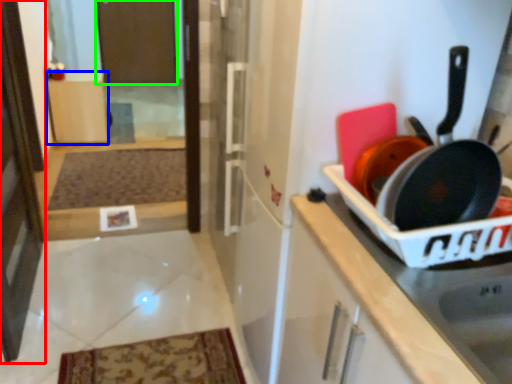
Question: Considering the real-world distances, which object is farthest from screen door (highlighted by a red box)? cabinetry (highlighted by a blue box) or screen door (highlighted by a green box)?

Choices:
 (A) cabinetry
 (B) screen door

Answer: (B)